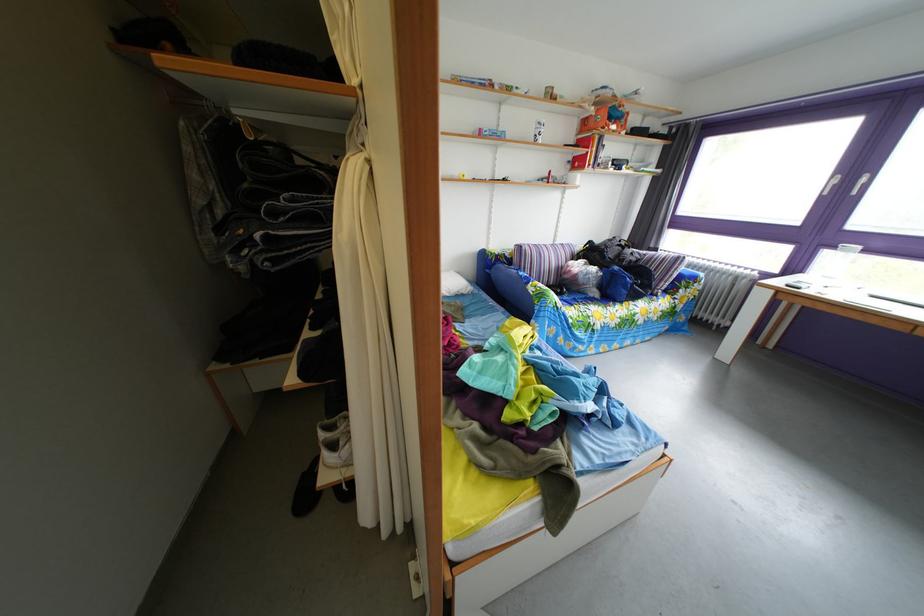
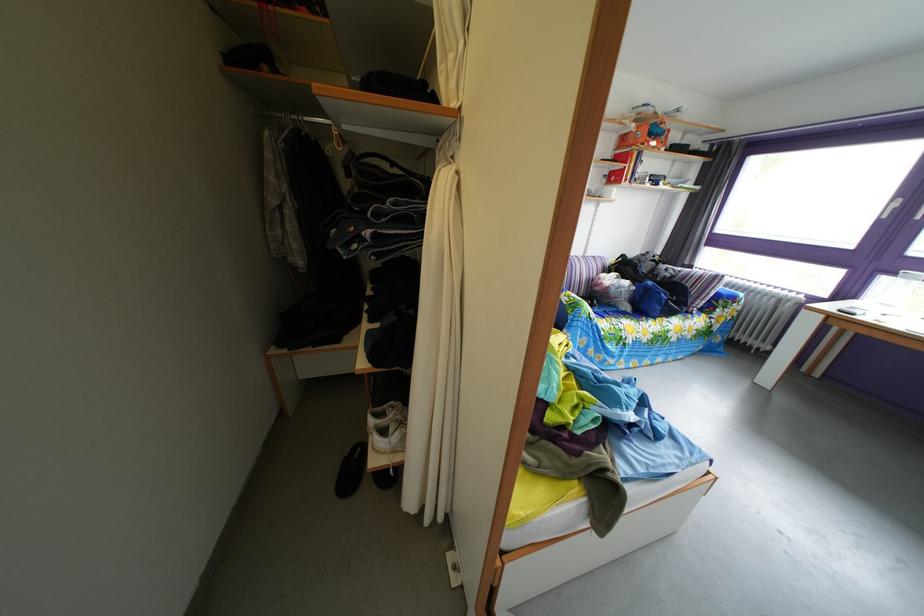
Where in the second image is the point corresponding to the point at 581,167 from the first image?

(618, 180)